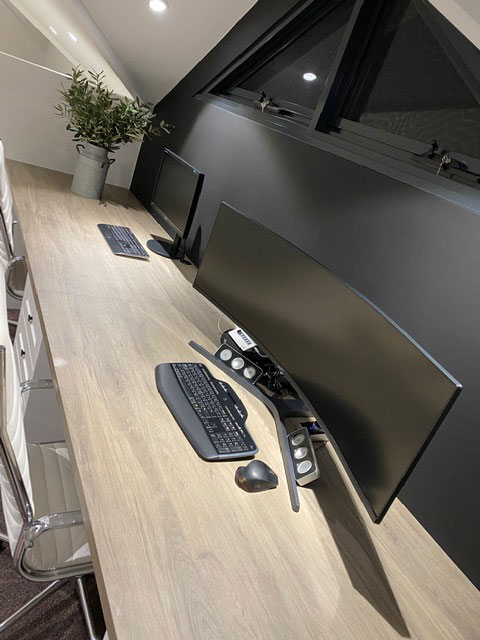
The image size is (480, 640). What are the coordinates of `wireless keyboard` in the screenshot? It's located at (205, 413), (122, 234).